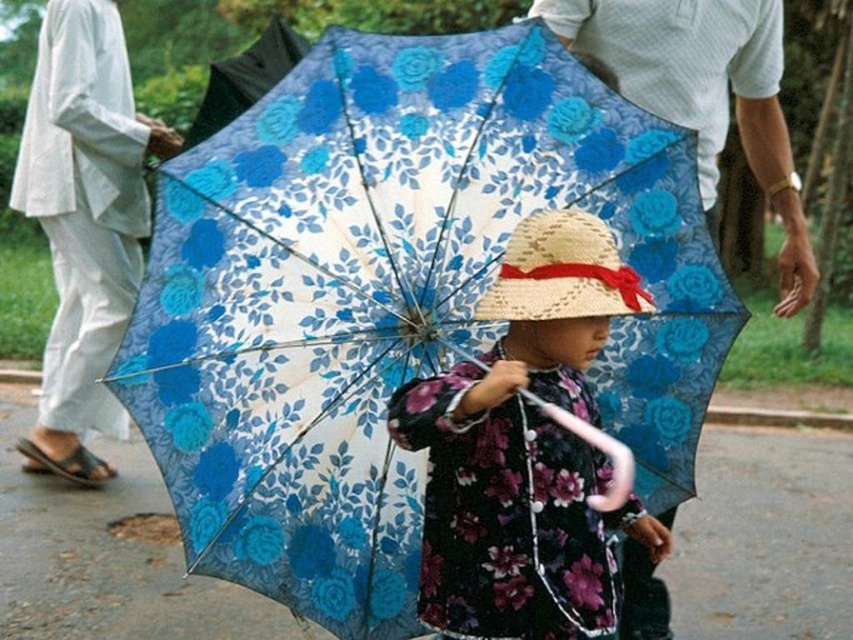
Question: Which object appears farthest from the camera in this image?

Choices:
 (A) floral-patterned fabric dress at center
 (B) transparent floral-patterned umbrella at center

Answer: (B)

Question: Considering the real-world distances, which object is farthest from the white textured shirt at upper right?

Choices:
 (A) straw hat at center
 (B) floral-patterned fabric dress at center

Answer: (B)

Question: Among these points, which one is farthest from the camera?

Choices:
 (A) (758, 74)
 (B) (521, 273)
 (C) (567, 214)
 (D) (103, 154)

Answer: (D)

Question: Considering the relative positions of transparent floral-patterned umbrella at center and white textured shirt at upper right in the image provided, where is transparent floral-patterned umbrella at center located with respect to white textured shirt at upper right?

Choices:
 (A) right
 (B) left

Answer: (B)

Question: Where is transparent floral-patterned umbrella at center located in relation to white textured shirt at upper right in the image?

Choices:
 (A) below
 (B) above

Answer: (A)

Question: Does transparent floral-patterned umbrella at center have a greater width compared to white textured shirt at upper right?

Choices:
 (A) yes
 (B) no

Answer: (A)